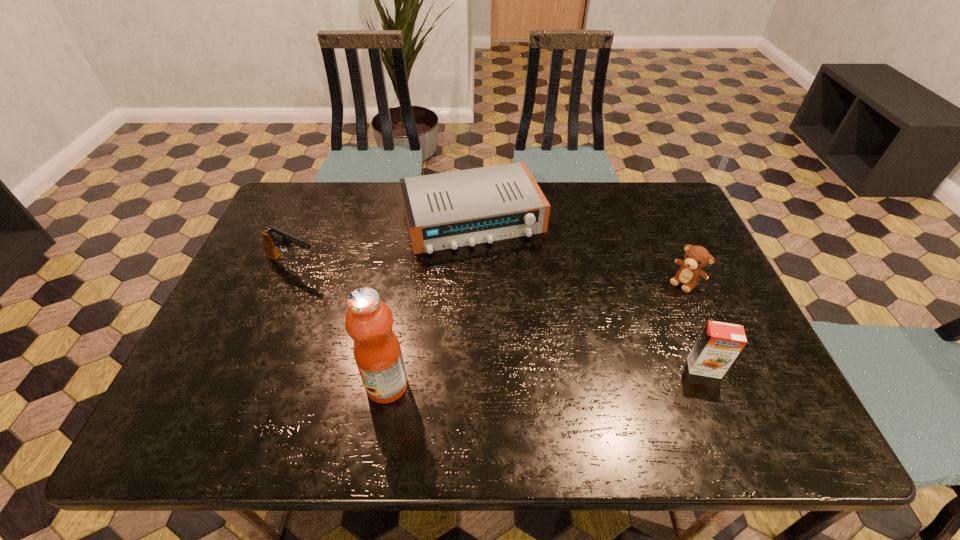
Where is `free space on the desktop that is between the fruit juice and the orange juice and is positioned on the face of the teddy bear`? This screenshot has height=540, width=960. free space on the desktop that is between the fruit juice and the orange juice and is positioned on the face of the teddy bear is located at coordinates (590, 374).

The height and width of the screenshot is (540, 960). Identify the location of vacant space on the desktop that is between the tallest object and the orange juice and is positioned on the control panel of the shortest object. (534, 377).

The height and width of the screenshot is (540, 960). I want to click on free space on the desktop that is between the fruit juice and the orange juice and is positioned along the barrel of the gun, so click(x=526, y=378).